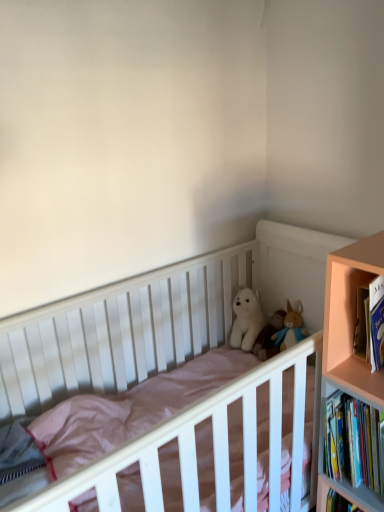
This screenshot has height=512, width=384. What do you see at coordinates (265, 326) in the screenshot?
I see `white plush toy at center` at bounding box center [265, 326].

The image size is (384, 512). Describe the element at coordinates (247, 319) in the screenshot. I see `white plush bear at center, the second doll from the right` at that location.

What do you see at coordinates (269, 337) in the screenshot? I see `white plush bear at center, which is the first doll from right to left` at bounding box center [269, 337].

This screenshot has height=512, width=384. What are the coordinates of `pink wood bookcase at right` in the screenshot? It's located at [348, 351].

Does pink wood bookcase at right appear on the left side of white plush bear at center, placed as the 2th doll when sorted from left to right?

No.

From the image's perspective, is pink wood bookcase at right on top of white plush bear at center, placed as the 2th doll when sorted from left to right?

No, from the image's perspective, pink wood bookcase at right is not over white plush bear at center, placed as the 2th doll when sorted from left to right.

Is point (353, 266) less distant than point (262, 344)?

Yes, point (353, 266) is closer to viewer.

From a real-world perspective, is pink wood bookcase at right located higher than white plush bear at center, which is the first doll from right to left?

Yes.

Looking at this image, is white plush toy at center a part of white wooden crib at center?

Yes, white plush toy at center is inside white wooden crib at center.

Considering the positions of objects white wooden crib at center and white plush toy at center in the image provided, who is more to the left, white wooden crib at center or white plush toy at center?

white wooden crib at center.

How many degrees apart are the facing directions of white wooden crib at center and white plush toy at center?

They differ by 88 degrees in their facing directions.

In the scene shown: Can you confirm if white wooden crib at center is thinner than white plush toy at center?

Incorrect, the width of white wooden crib at center is not less than that of white plush toy at center.

Can you tell me how much white plush toy at center and white wooden crib at center differ in facing direction?

white plush toy at center and white wooden crib at center are facing 88 degrees away from each other.

Considering the sizes of white plush toy at center and white wooden crib at center in the image, is white plush toy at center bigger or smaller than white wooden crib at center?

white plush toy at center is smaller than white wooden crib at center.

Can you confirm if white plush toy at center is taller than white wooden crib at center?

No, white plush toy at center is not taller than white wooden crib at center.

There is a white plush bear at center, the 1th doll positioned from the left. In order to click on bookcase above it (from a real-world perspective) in this screenshot , I will do `click(348, 351)`.

Is white plush bear at center, the 1th doll positioned from the left, facing away from pink wood bookcase at right?

No, white plush bear at center, the 1th doll positioned from the left,'s orientation is not away from pink wood bookcase at right.

Which of these two, white plush bear at center, the 1th doll positioned from the left, or pink wood bookcase at right, stands shorter?

white plush bear at center, the 1th doll positioned from the left.

In terms of size, does white plush bear at center, the 1th doll positioned from the left, appear bigger or smaller than pink wood bookcase at right?

Clearly, white plush bear at center, the 1th doll positioned from the left, is smaller in size than pink wood bookcase at right.

In the image, is white plush bear at center, placed as the 2th doll when sorted from left to right, on the left side or the right side of hardcover books at right?

From the image, it's evident that white plush bear at center, placed as the 2th doll when sorted from left to right, is to the left of hardcover books at right.

Is white plush bear at center, placed as the 2th doll when sorted from left to right, touching hardcover books at right?

No, white plush bear at center, placed as the 2th doll when sorted from left to right, is not with hardcover books at right.

From a real-world perspective, who is located higher, white plush bear at center, which is the first doll from right to left, or hardcover books at right?

hardcover books at right is physically above.

Is point (275, 326) farther from viewer compared to point (250, 338)?

Yes.

Considering the sizes of white plush bear at center, placed as the 2th doll when sorted from left to right, and white plush bear at center, the 1th doll positioned from the left, in the image, is white plush bear at center, placed as the 2th doll when sorted from left to right, wider or thinner than white plush bear at center, the 1th doll positioned from the left,?

Clearly, white plush bear at center, placed as the 2th doll when sorted from left to right, has more width compared to white plush bear at center, the 1th doll positioned from the left.

Is white plush bear at center, the second doll from the right, inside white plush bear at center, which is the first doll from right to left?

Actually, white plush bear at center, the second doll from the right, is outside white plush bear at center, which is the first doll from right to left.

From the image's perspective, who appears lower, white plush bear at center, which is the first doll from right to left, or white plush bear at center, the 1th doll positioned from the left?

From the image's view, white plush bear at center, which is the first doll from right to left, is below.

Which is farther from the camera, (x=221, y=295) or (x=378, y=411)?

Positioned behind is point (x=221, y=295).

Is white wooden crib at center positioned far away from hardcover books at right?

They are positioned close to each other.

Where is `infant bed located below the hardcover books at right (from the image's perspective)`? Image resolution: width=384 pixels, height=512 pixels. infant bed located below the hardcover books at right (from the image's perspective) is located at coordinates (162, 314).

I want to click on bookcase that appears above the white plush bear at center, placed as the 2th doll when sorted from left to right (from a real-world perspective), so point(348,351).

The height and width of the screenshot is (512, 384). I want to click on infant bed located in front of the white plush toy at center, so click(162, 314).

When comparing their distances from white wooden crib at center, does white plush bear at center, which is the first doll from right to left, or white plush bear at center, the 1th doll positioned from the left, seem closer?

Based on the image, white plush bear at center, the 1th doll positioned from the left, appears to be nearer to white wooden crib at center.

Which object lies further to the anchor point pink wood bookcase at right, white plush toy at center or white plush bear at center, which is the first doll from right to left?

Based on the image, white plush bear at center, which is the first doll from right to left, appears to be further to pink wood bookcase at right.

Which object lies further to the anchor point hardcover books at right, white plush bear at center, the 1th doll positioned from the left, or white plush toy at center?

white plush bear at center, the 1th doll positioned from the left, lies further to hardcover books at right than the other object.

Considering their positions, is pink wood bookcase at right positioned closer to white plush bear at center, placed as the 2th doll when sorted from left to right, than white plush toy at center?

Based on the image, white plush toy at center appears to be nearer to white plush bear at center, placed as the 2th doll when sorted from left to right.

Considering their positions, is hardcover books at right positioned further to pink wood bookcase at right than white plush toy at center?

white plush toy at center.

Based on their spatial positions, is white wooden crib at center or white plush bear at center, which is the first doll from right to left, further from pink wood bookcase at right?

white wooden crib at center.

From the image, which object appears to be nearer to white plush bear at center, placed as the 2th doll when sorted from left to right, white plush toy at center or white wooden crib at center?

white plush toy at center is positioned closer to the anchor white plush bear at center, placed as the 2th doll when sorted from left to right.

Estimate the real-world distances between objects in this image. Which object is closer to white plush bear at center, which is the first doll from right to left, white wooden crib at center or white plush toy at center?

white plush toy at center is closer to white plush bear at center, which is the first doll from right to left.

Image resolution: width=384 pixels, height=512 pixels. I want to click on book positioned between pink wood bookcase at right and white plush bear at center, placed as the 2th doll when sorted from left to right, from near to far, so click(352, 442).

Find the location of `doll located between hardcover books at right and white plush bear at center, the second doll from the right, in the depth direction`. doll located between hardcover books at right and white plush bear at center, the second doll from the right, in the depth direction is located at coordinates (269, 337).

This screenshot has width=384, height=512. In order to click on toy between pink wood bookcase at right and white plush bear at center, the 1th doll positioned from the left, from front to back in this screenshot , I will do `click(265, 326)`.

Where is `book between white wooden crib at center and white plush toy at center along the z-axis`? The image size is (384, 512). book between white wooden crib at center and white plush toy at center along the z-axis is located at coordinates (352, 442).